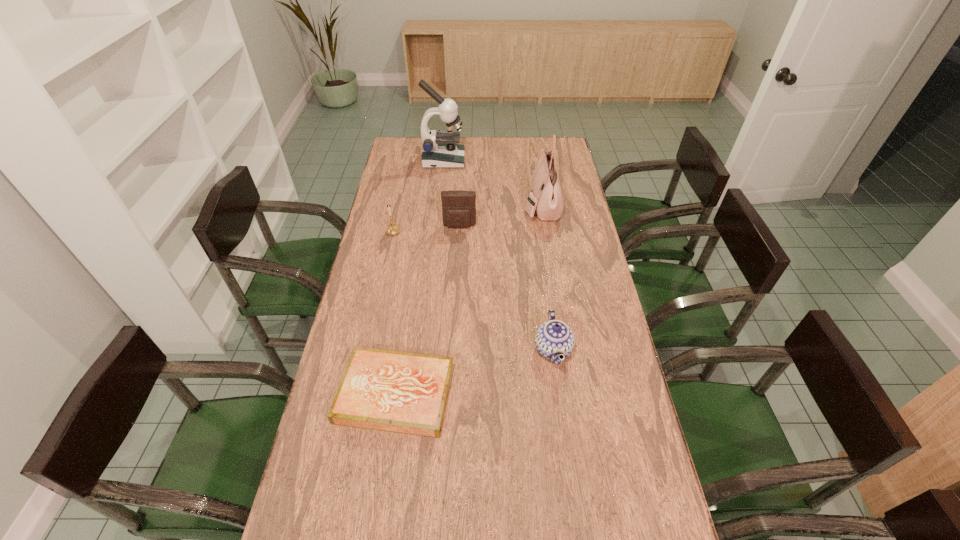
Where is `microscope`? This screenshot has width=960, height=540. microscope is located at coordinates (440, 150).

Identify the location of the farthest object. The image size is (960, 540). (440, 150).

Where is `the second tallest object`? the second tallest object is located at coordinates (547, 199).

Identify the location of pouch. (458, 206).

I want to click on candle holder, so click(x=393, y=229).

You are a GUI agent. You are given a task and a screenshot of the screen. Output one action in this format:
    pyautogui.click(x=<x>, y=<y>)
    Task: Click on the chinaware
    Image resolution: width=960 pixels, height=540 pixels.
    Given the screenshot: What is the action you would take?
    click(x=553, y=338)

Where is `the shortest object`? the shortest object is located at coordinates (401, 392).

Identify the location of free space located at the eyepiece of the tallest object. Image resolution: width=960 pixels, height=540 pixels. (496, 160).

Where is `free location located on the side of the handbag with the attached pouch`? This screenshot has width=960, height=540. free location located on the side of the handbag with the attached pouch is located at coordinates (429, 204).

I want to click on vacant position located on the side of the handbag with the attached pouch, so click(x=453, y=204).